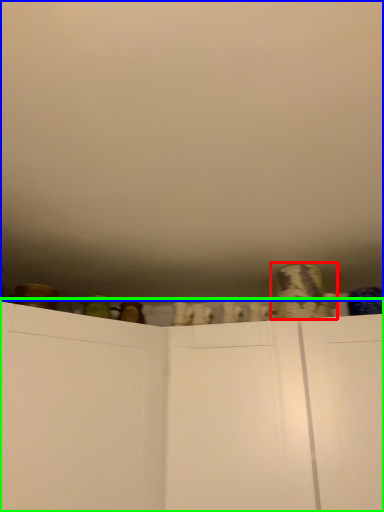
Question: Which object is positioned closest to pottery (highlighted by a red box)? Select from backdrop (highlighted by a blue box) and cupboard (highlighted by a green box).

Choices:
 (A) backdrop
 (B) cupboard

Answer: (B)